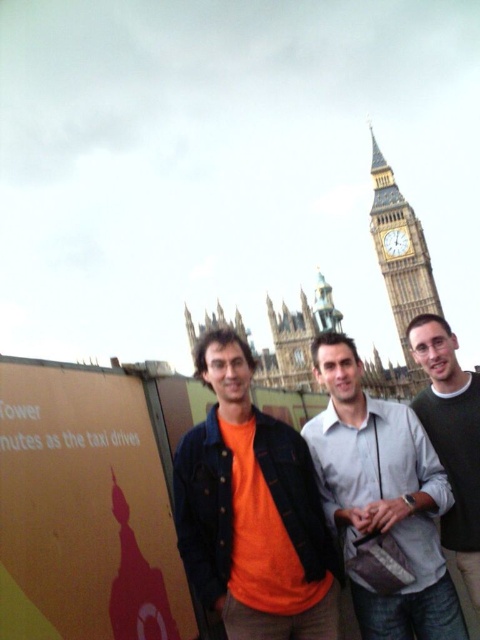
You are a photographer trying to position two markers on the image to indicate the positions of the two landmarks in the background. The first marker should be placed at point (x=456, y=396) and the second at point (x=415, y=390). Which marker will appear closer to the camera in the final photo?

Point (x=456, y=396) is closer to the viewer than point (x=415, y=390), so the marker placed at point (x=456, y=396) will appear closer to the camera in the final photo.

You are a photographer trying to capture a detailed shot of the green sweater at center. You notice a point marked at coordinates (452, 436). Where is this point located in relation to the green sweater at center?

The point at coordinates (452, 436) is located on the green sweater at center.

You are a photographer trying to adjust the framing of the photo to ensure all subjects are visible. Given that the light gray shirt at center and the green sweater at center are both in the middle of the frame, which of these two should you focus on first to avoid cropping someone out?

The green sweater at center is taller than the light gray shirt at center, so you should focus on ensuring the green sweater at center is fully visible first to avoid cropping.